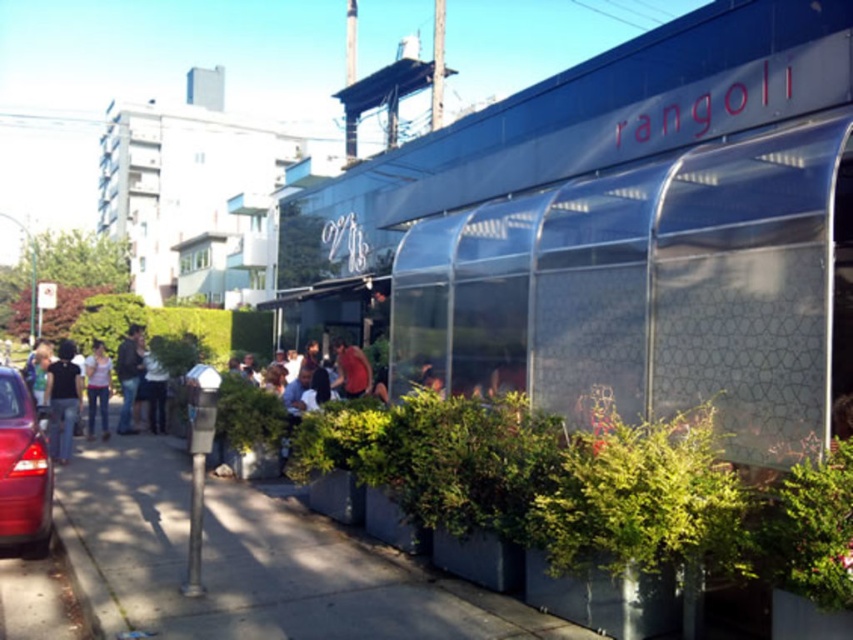
You are a photographer standing at the entrance of the restaurant. You want to capture a photo that includes both the denim jacket at left and the red fabric shirt at center. What is the minimum distance you need to move backward to ensure both subjects are in frame?

The denim jacket at left and red fabric shirt at center are 5.78 meters apart from each other. To capture both in the frame, you need to move backward until the distance between them fits within your camera lens field of view. The exact distance depends on the lens focal length and sensor size, but generally, moving back several meters should suffice.

You are a delivery person trying to park your shiny red car at lower left in the parking lot near the restaurant. The parking lot has a designated parking spot at point 0.734, 0.027. Can you park your car there?

The shiny red car at lower left is already positioned at point (22, 468), so it is already parked in the designated parking spot.

You are a fashion blogger who wants to compare the lengths of the denim jacket at left and the red fabric shirt at center in the image. Which one is shorter?

The denim jacket at left is shorter than the red fabric shirt at center.